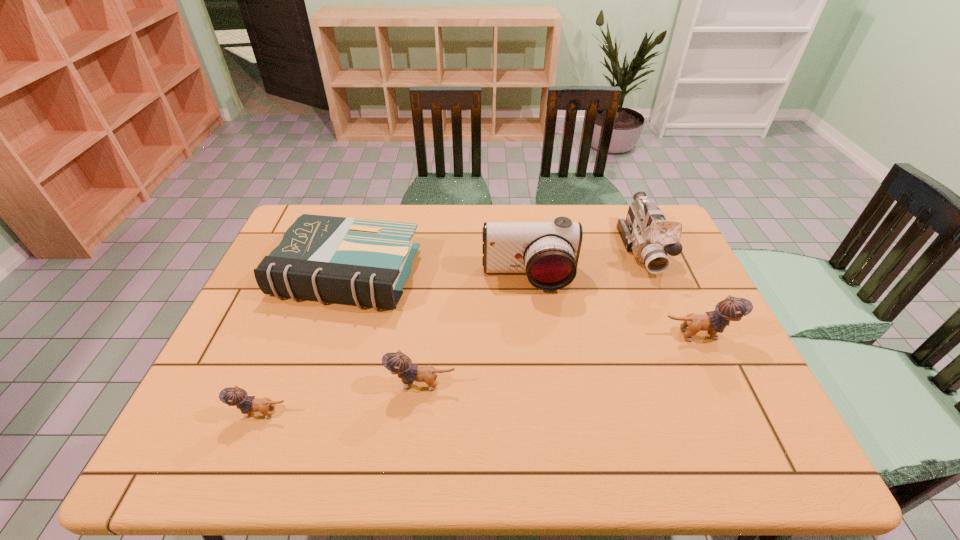
Find the location of a particular element. free spot between the shortest kitten and the paperback book is located at coordinates (304, 343).

Locate an element on the screen. empty space between the rightmost kitten and the third object from right to left is located at coordinates (612, 307).

Locate an element on the screen. vacant space in between the rightmost kitten and the right camcorder is located at coordinates (670, 292).

Identify which object is the fourth nearest to the right camcorder. Please provide its 2D coordinates. Your answer should be formatted as a tuple, i.e. [(x, y)], where the tuple contains the x and y coordinates of a point satisfying the conditions above.

[(366, 262)]

Identify which object is the nearest to the left camcorder. Please provide its 2D coordinates. Your answer should be formatted as a tuple, i.e. [(x, y)], where the tuple contains the x and y coordinates of a point satisfying the conditions above.

[(646, 232)]

Choose which kitten is the nearest neighbor to the shortest kitten. Please provide its 2D coordinates. Your answer should be formatted as a tuple, i.e. [(x, y)], where the tuple contains the x and y coordinates of a point satisfying the conditions above.

[(398, 363)]

Select which kitten appears as the second closest to the left camcorder. Please provide its 2D coordinates. Your answer should be formatted as a tuple, i.e. [(x, y)], where the tuple contains the x and y coordinates of a point satisfying the conditions above.

[(398, 363)]

Find the location of a particular element. This screenshot has width=960, height=540. vacant space that satisfies the following two spatial constraints: 1. on the front-facing side of the right camcorder; 2. on the front-facing side of the nearest object is located at coordinates (712, 413).

What are the coordinates of `free space that satisfies the following two spatial constraints: 1. on the front-facing side of the right camcorder; 2. on the front-facing side of the second farthest kitten` in the screenshot? It's located at (700, 384).